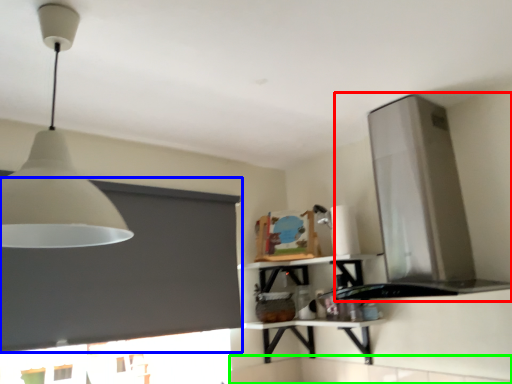
Question: Estimate the real-world distances between objects in this image. Which object is closer to vent (highlighted by a red box), window screen (highlighted by a blue box) or counter top (highlighted by a green box)?

Choices:
 (A) window screen
 (B) counter top

Answer: (B)